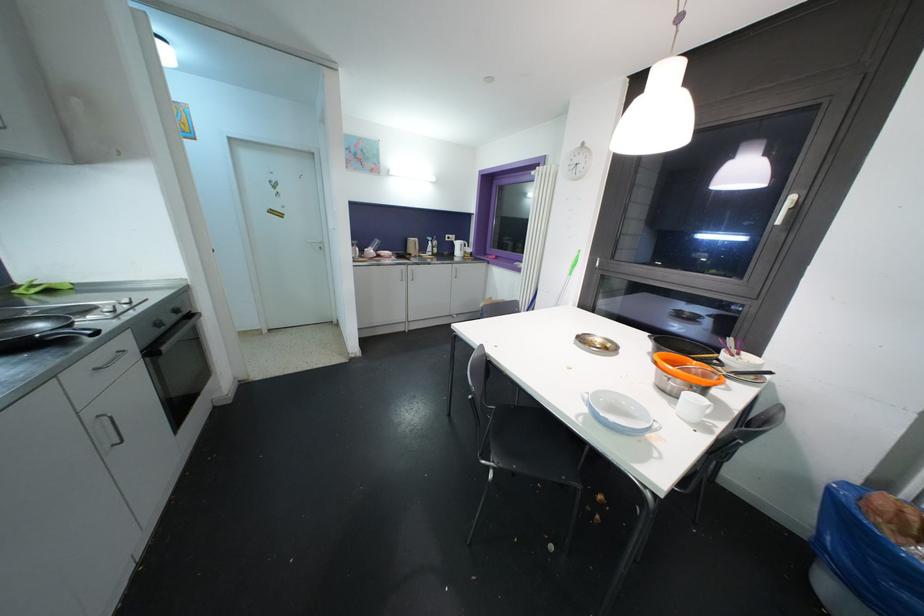
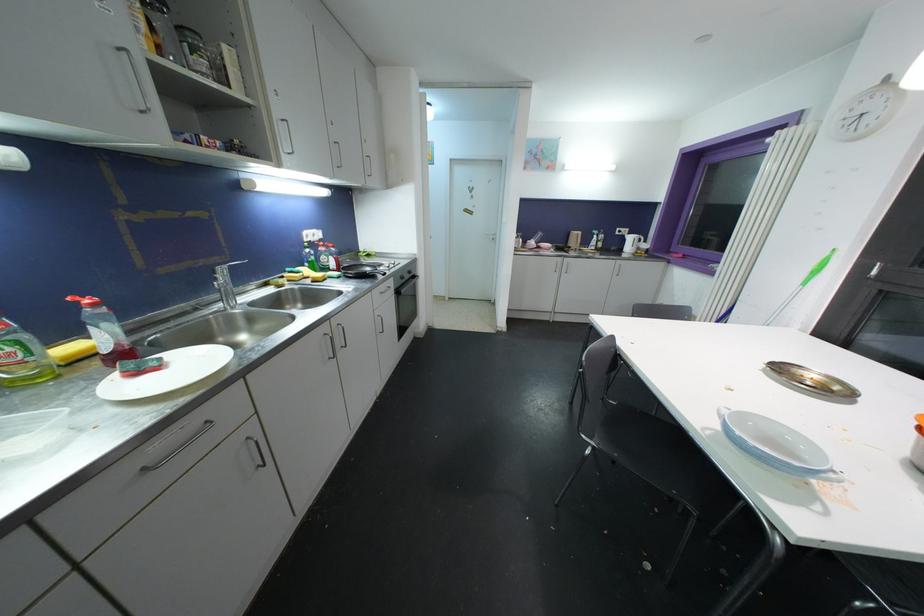
Where in the second image is the point corresponding to point 493,468 from the first image?

(593, 446)